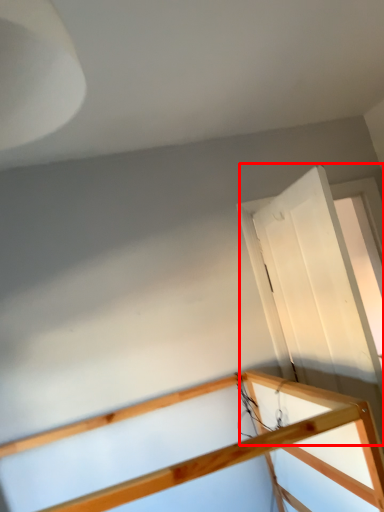
Question: From the image's perspective, where is glass door (annotated by the red box) located relative to rail?

Choices:
 (A) below
 (B) above

Answer: (B)